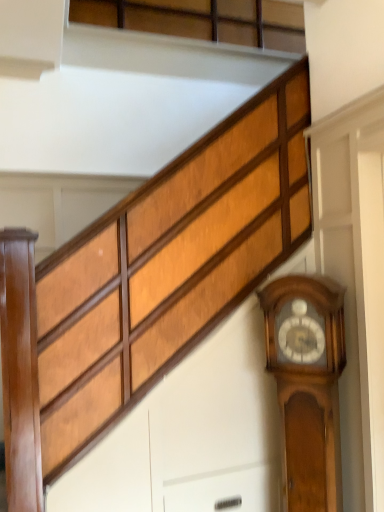
Where is `polished wood grandfather clock at right`? This screenshot has height=512, width=384. polished wood grandfather clock at right is located at coordinates coord(307,384).

The height and width of the screenshot is (512, 384). Describe the element at coordinates (307, 384) in the screenshot. I see `polished wood grandfather clock at right` at that location.

Find the location of `polished wood grandfather clock at right`. polished wood grandfather clock at right is located at coordinates (307, 384).